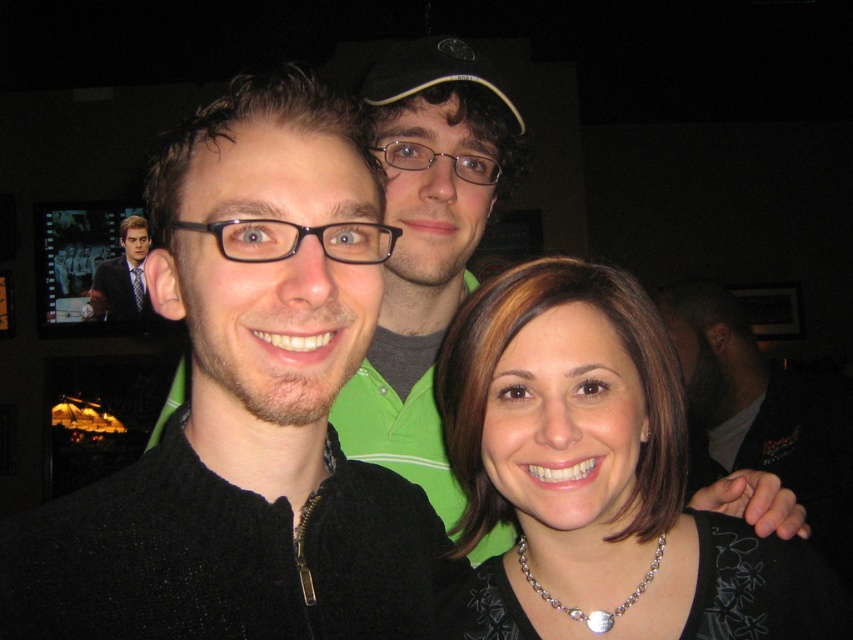
Is the position of matte black necklace at center more distant than that of matte black suit at upper left?

That is False.

Between point (575, 531) and point (90, 292), which one is positioned behind?

Point (90, 292)

Where is `matte black necklace at center`? matte black necklace at center is located at coordinates [599, 474].